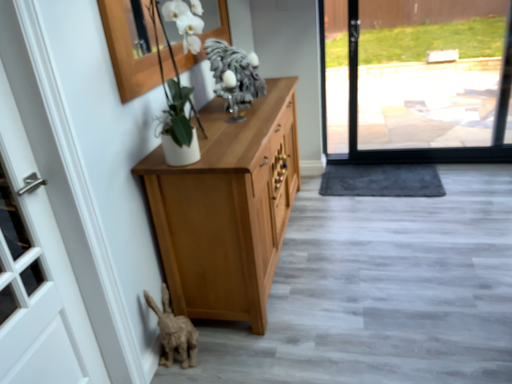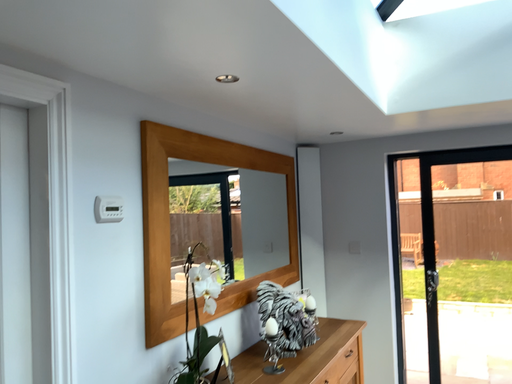
Question: Which way did the camera rotate in the video?

Choices:
 (A) rotated upward
 (B) rotated downward

Answer: (A)